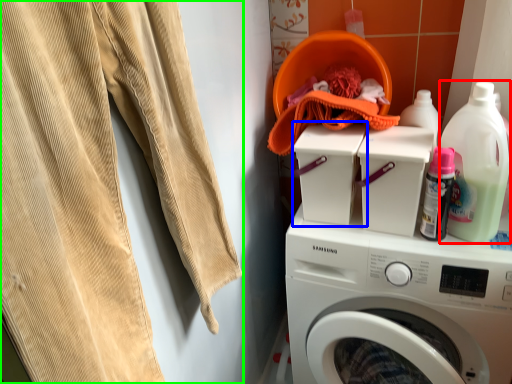
Question: Which object is positioned closest to cleaning product (highlighted by a red box)? Select from washing machine (highlighted by a blue box) and sweat pant (highlighted by a green box).

Choices:
 (A) washing machine
 (B) sweat pant

Answer: (A)